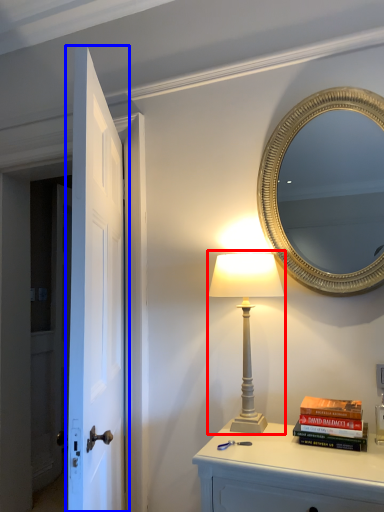
Question: Which object is further to the camera taking this photo, table lamp (highlighted by a red box) or door (highlighted by a blue box)?

Choices:
 (A) table lamp
 (B) door

Answer: (A)